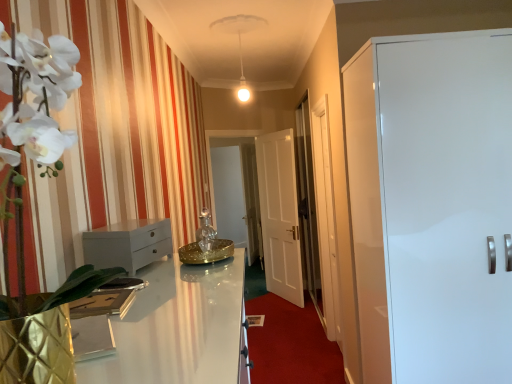
The height and width of the screenshot is (384, 512). In order to click on vacant space that is to the left of transparent glass door at center, the 2th glass door when ordered from left to right in this screenshot , I will do `click(287, 355)`.